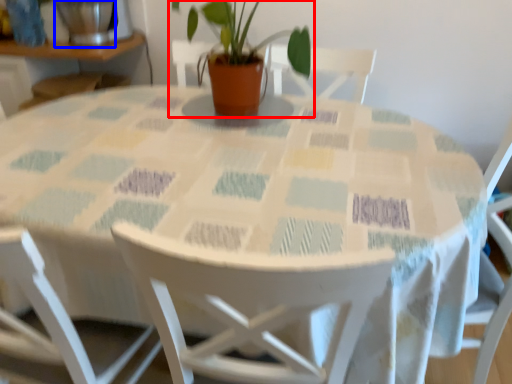
Question: Which point is further to the camera, houseplant (highlighted by a red box) or glass vase (highlighted by a blue box)?

Choices:
 (A) houseplant
 (B) glass vase

Answer: (B)